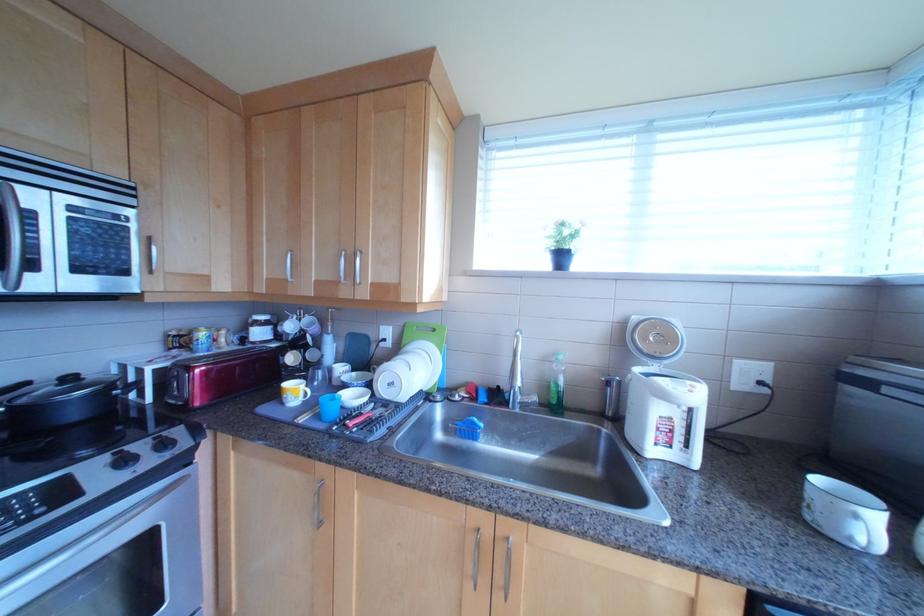
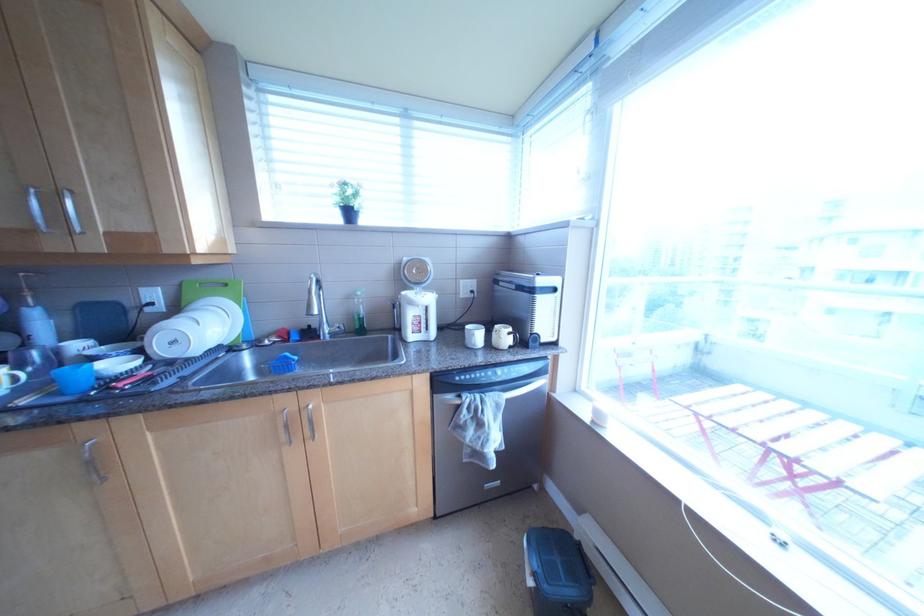
Question: The camera is either moving clockwise (left) or counter-clockwise (right) around the object. The first image is from the beginning of the video and the second image is from the end. Is the camera moving left or right when shooting the video?

Choices:
 (A) Left
 (B) Right

Answer: (A)